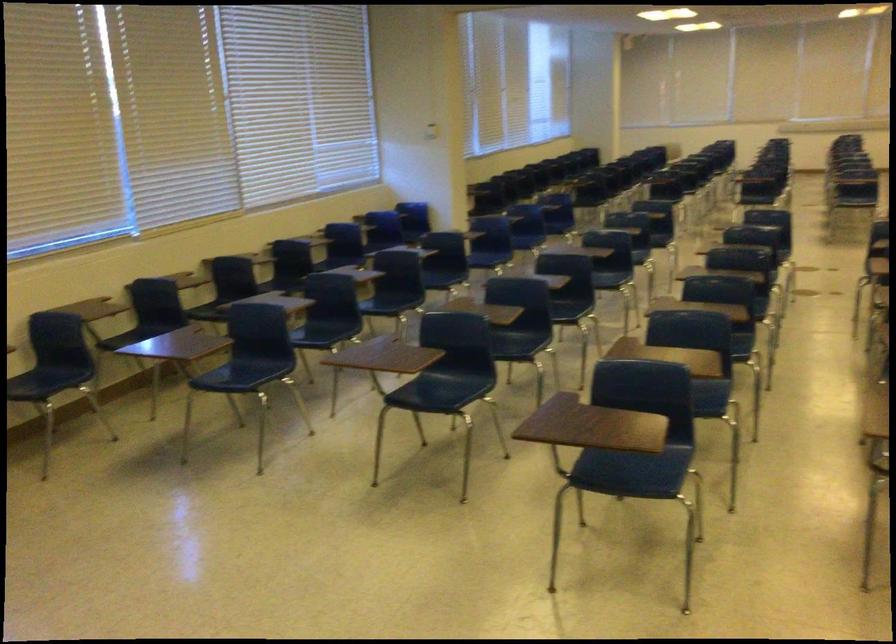
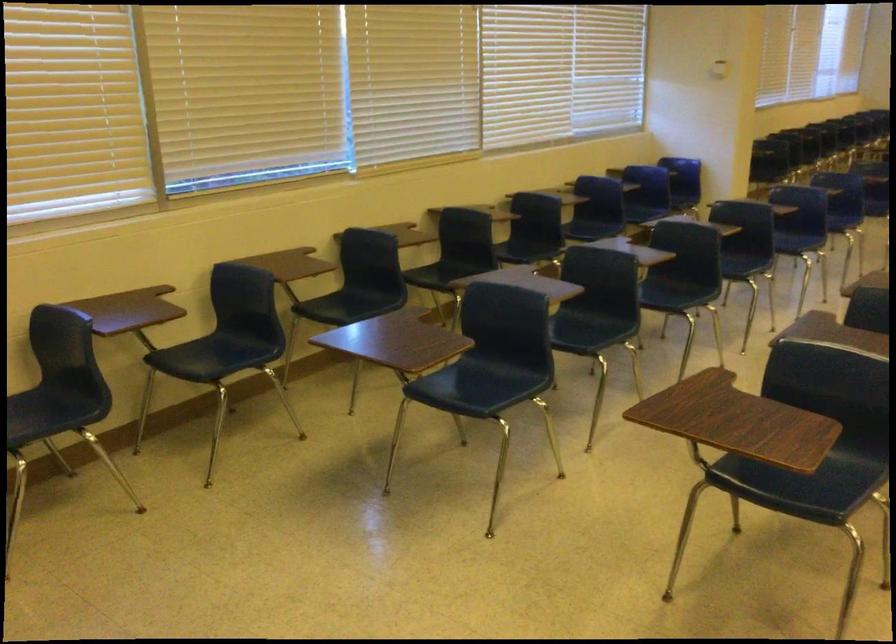
The images are taken continuously from a first-person perspective. In which direction are you moving?

The movement direction of the cameraman is left, forward.